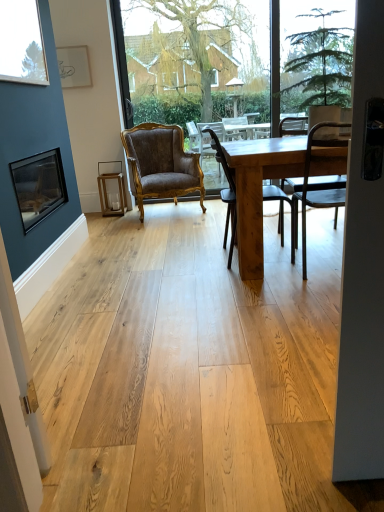
At what (x,y) coordinates should I click in order to perform the action: click on free point below clear glass window at upper left (from a real-world perspective). Please return your answer as a coordinate pair (x, y). Image resolution: width=384 pixels, height=512 pixels. Looking at the image, I should click on (54, 242).